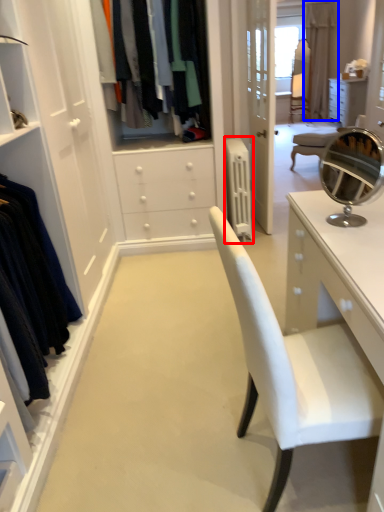
Question: Which object appears farthest to the camera in this image, radiator (highlighted by a red box) or curtain (highlighted by a blue box)?

Choices:
 (A) radiator
 (B) curtain

Answer: (B)